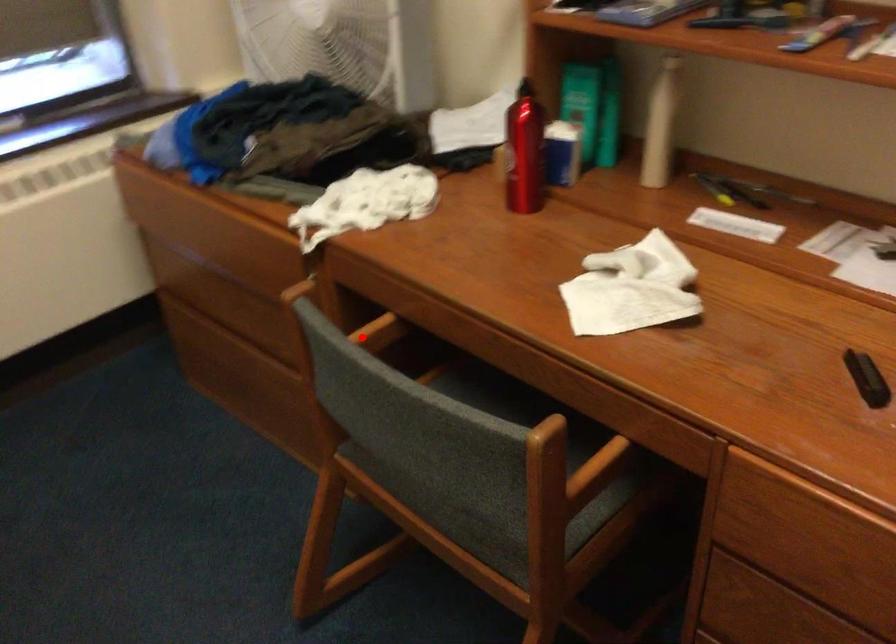
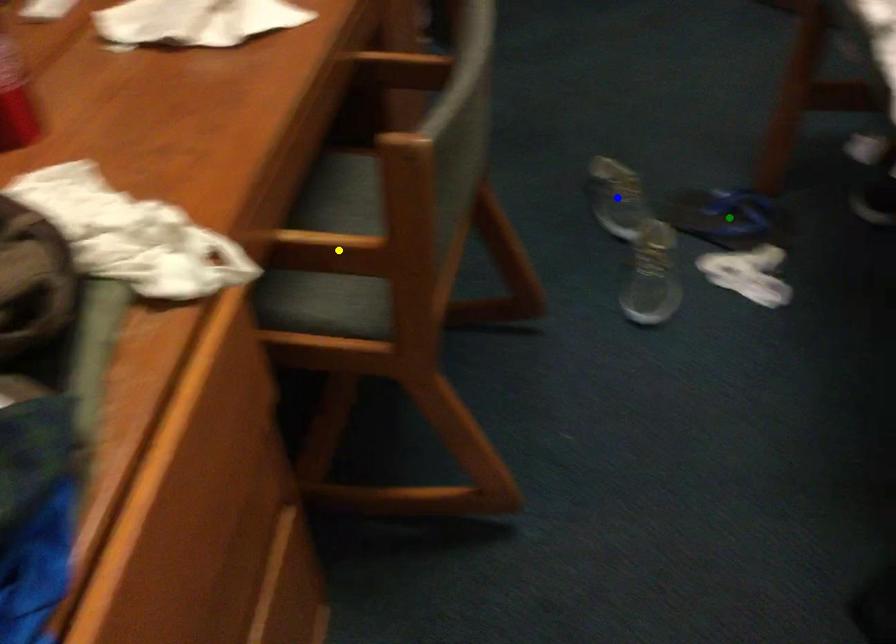
Question: I am providing you with two images of the same scene from different viewpoints. A red point is marked on the first image. You are given multiple points on the second image. Which spot in image 2 lines up with the point in image 1?

Choices:
 (A) green point
 (B) blue point
 (C) yellow point

Answer: (C)